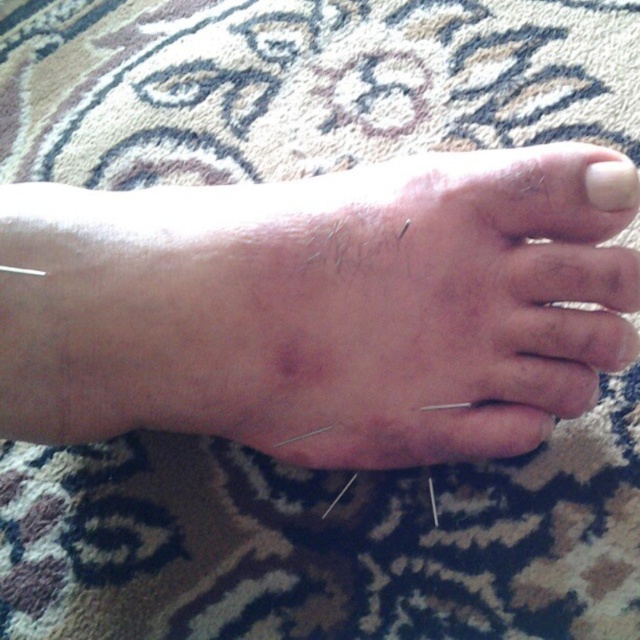
You are a therapist examining the foot in the image. You need to determine which of the two points, point (44, 296) or point (602, 188), is closer to you. Which one is closer?

Point (44, 296) is closer to you than point (602, 188) because it is further to the viewer.

In the scene shown: You are a therapist observing a foot with acupuncture needles. You notice the skin at center and the white matte nail at upper right. Which object is positioned more towards the right side?

The white matte nail at upper right is positioned more towards the right side than the skin at center.